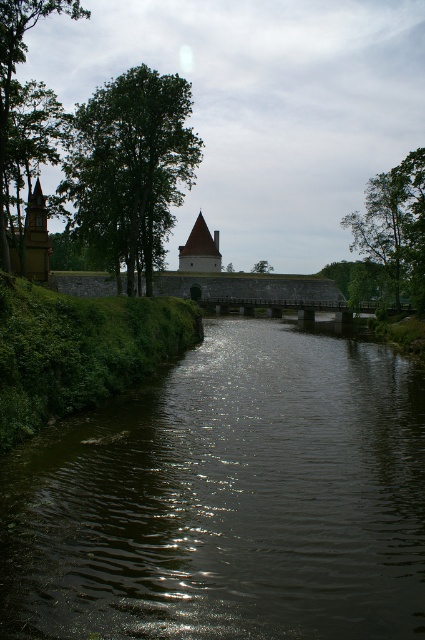
Does point (132, 282) lie in front of point (388, 195)?

That is True.

Can you confirm if green leafy tree at upper left is shorter than green leafy tree at upper right?

Incorrect, green leafy tree at upper left's height does not fall short of green leafy tree at upper right's.

Where is `green leafy tree at upper left`? This screenshot has height=640, width=425. green leafy tree at upper left is located at coordinates (130, 168).

In order to click on green leafy tree at upper left in this screenshot , I will do `click(130, 168)`.

Between green leafy tree at left and smooth white tower at center, which one has more height?

With more height is green leafy tree at left.

Is green leafy tree at left to the left of smooth white tower at center from the viewer's perspective?

Yes, green leafy tree at left is to the left of smooth white tower at center.

Is point (11, 36) closer to camera compared to point (180, 253)?

That is True.

Find the location of `green leafy tree at left`. green leafy tree at left is located at coordinates (14, 68).

Between point (422, 531) and point (365, 196), which one is positioned in front?

Point (422, 531) is more forward.

Does dark reflective water at center lie behind green leafy tree at upper right?

No, it is not.

At what (x,y) coordinates should I click in order to perform the action: click on dark reflective water at center. Please return your answer as a coordinate pair (x, y). The height and width of the screenshot is (640, 425). Looking at the image, I should click on (227, 499).